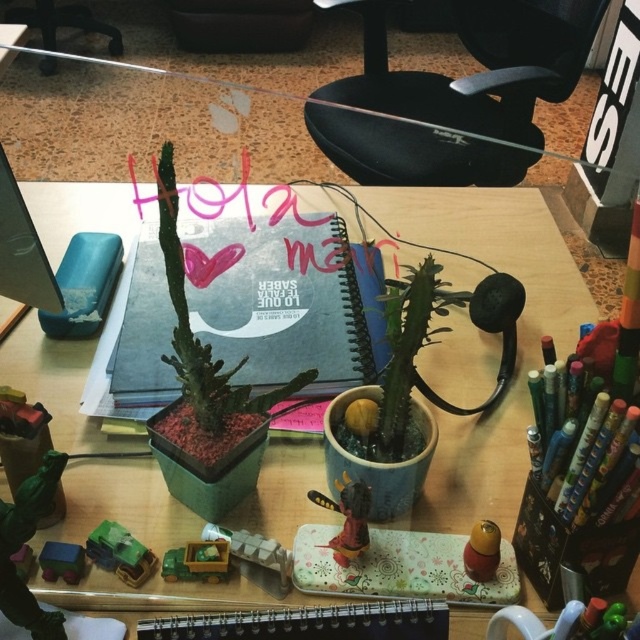
Question: From the image, what is the correct spatial relationship of blue matte notebook at center in relation to shiny plastic bee at center?

Choices:
 (A) right
 (B) left

Answer: (B)

Question: Estimate the real-world distances between objects in this image. Which object is closer to the blue rubber at upper left?

Choices:
 (A) shiny plastic bee at center
 (B) matte blue toy truck at lower left

Answer: (B)

Question: Can you confirm if matte brown rubber stamp at center is positioned above matte blue toy truck at lower left?

Choices:
 (A) no
 (B) yes

Answer: (B)

Question: Among these points, which one is nearest to the camera?

Choices:
 (A) (467, 561)
 (B) (356, 545)

Answer: (A)

Question: Which object appears closest to the camera in this image?

Choices:
 (A) blue matte notebook at center
 (B) blue rubber at upper left

Answer: (A)

Question: Can you confirm if matte brown rubber stamp at center is thinner than matte blue toy truck at lower left?

Choices:
 (A) no
 (B) yes

Answer: (B)